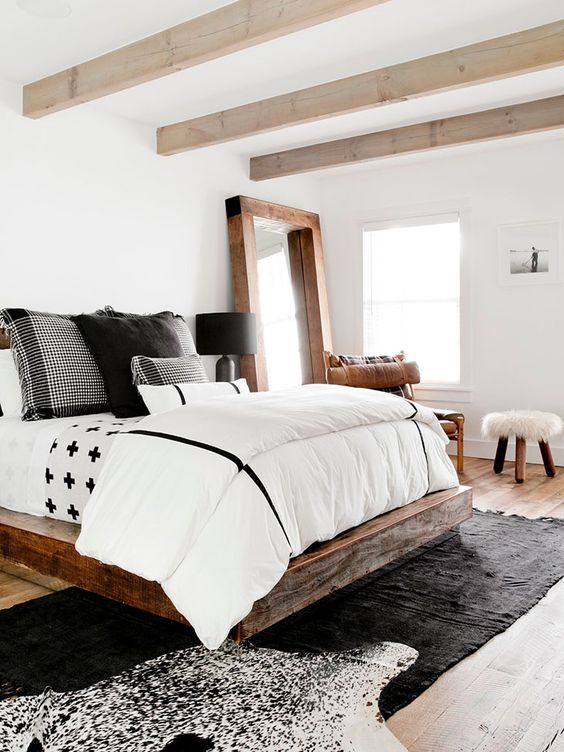
Locate an element on the screen. soft seat is located at coordinates (526, 419).